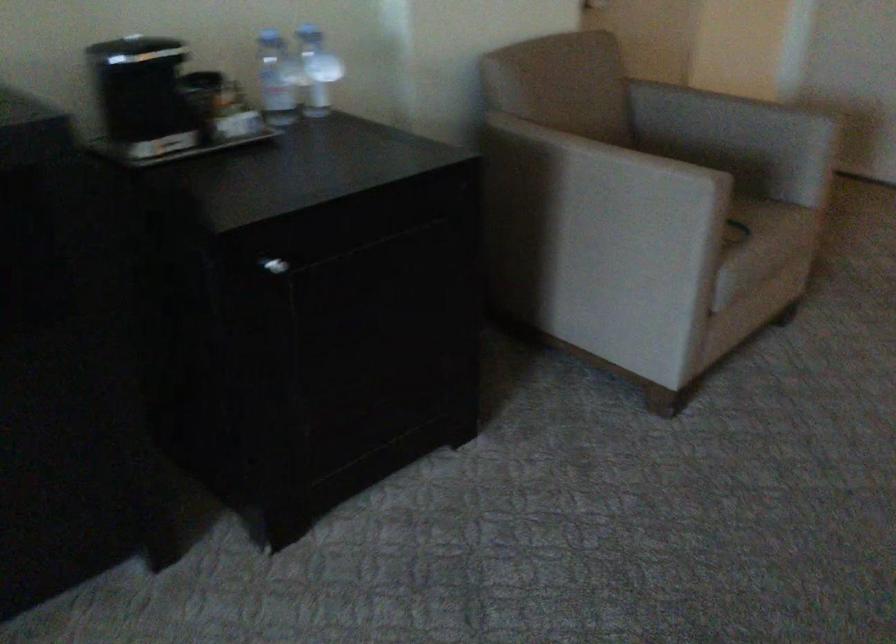
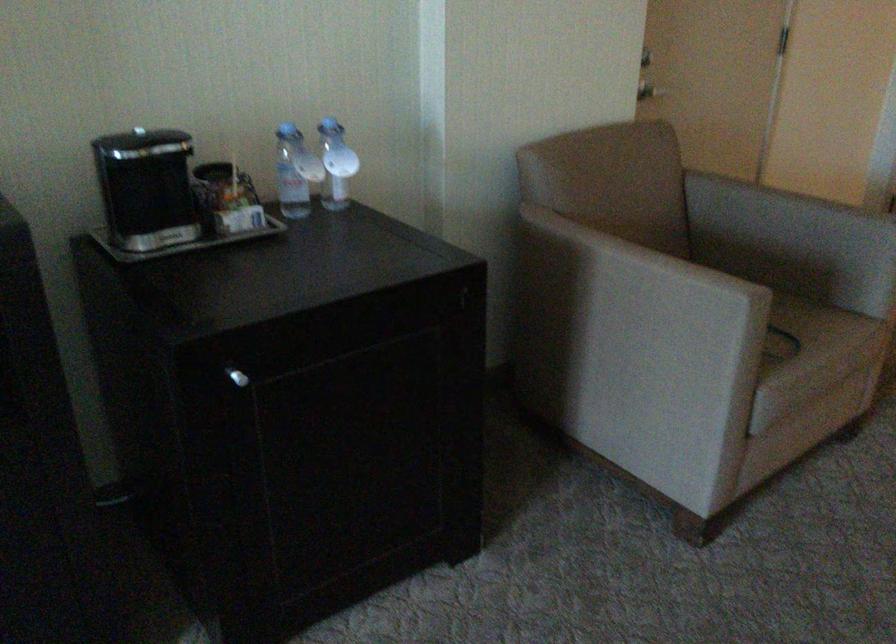
Where in the second image is the point corresponding to point (203, 82) from the first image?

(212, 171)